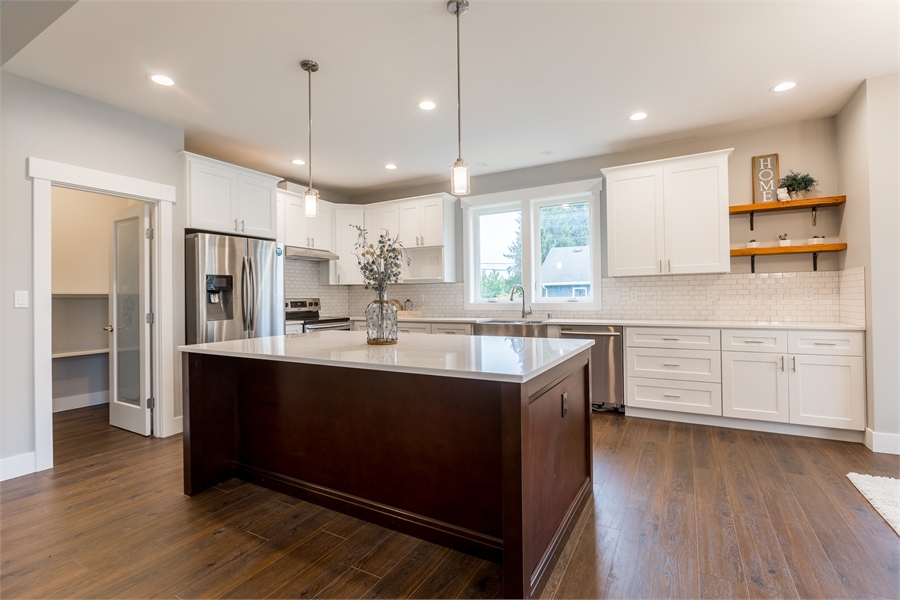
Identify the location of cabinet pulls. This screenshot has height=600, width=900. (234, 225), (240, 227), (307, 241), (336, 277), (414, 242), (418, 242), (659, 269), (670, 269), (778, 364), (792, 366).